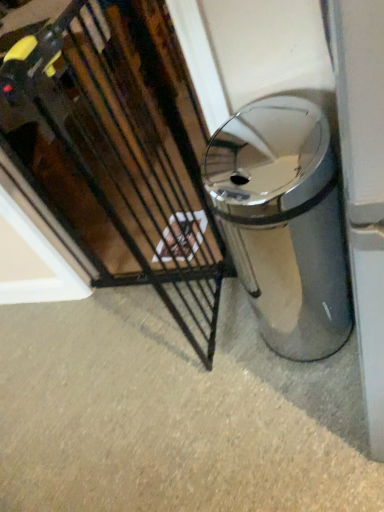
Question: Can you confirm if black metal gate at center is shorter than polished stainless steel trash can at center?

Choices:
 (A) yes
 (B) no

Answer: (B)

Question: Could you tell me if black metal gate at center is turned towards polished stainless steel trash can at center?

Choices:
 (A) no
 (B) yes

Answer: (B)

Question: Is black metal gate at center not close to polished stainless steel trash can at center?

Choices:
 (A) no
 (B) yes

Answer: (A)

Question: Does black metal gate at center have a larger size compared to polished stainless steel trash can at center?

Choices:
 (A) yes
 (B) no

Answer: (A)

Question: From a real-world perspective, is black metal gate at center located beneath polished stainless steel trash can at center?

Choices:
 (A) no
 (B) yes

Answer: (A)

Question: Is polished stainless steel trash can at center at the back of black metal gate at center?

Choices:
 (A) yes
 (B) no

Answer: (A)

Question: Can we say polished stainless steel trash can at center lies outside black metal gate at center?

Choices:
 (A) yes
 (B) no

Answer: (A)

Question: Does polished stainless steel trash can at center have a lesser width compared to black metal gate at center?

Choices:
 (A) no
 (B) yes

Answer: (A)

Question: Could you tell me if polished stainless steel trash can at center is turned towards black metal gate at center?

Choices:
 (A) no
 (B) yes

Answer: (A)

Question: Is black metal gate at center a part of polished stainless steel trash can at center?

Choices:
 (A) no
 (B) yes

Answer: (A)

Question: From a real-world perspective, does polished stainless steel trash can at center sit lower than black metal gate at center?

Choices:
 (A) no
 (B) yes

Answer: (B)

Question: Is polished stainless steel trash can at center in contact with black metal gate at center?

Choices:
 (A) no
 (B) yes

Answer: (A)

Question: From the image's perspective, is black metal gate at center above or below polished stainless steel trash can at center?

Choices:
 (A) below
 (B) above

Answer: (B)